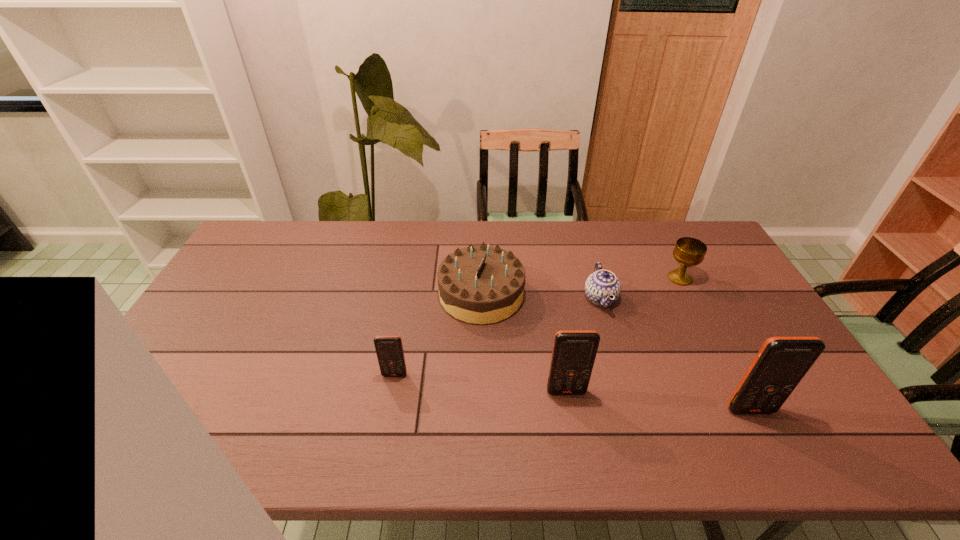
Locate an element on the screen. The height and width of the screenshot is (540, 960). the farthest cellular telephone is located at coordinates (389, 349).

Locate an element on the screen. This screenshot has width=960, height=540. the leftmost object is located at coordinates (389, 349).

Where is `the third object from left to right`? The width and height of the screenshot is (960, 540). the third object from left to right is located at coordinates (574, 351).

Find the location of a particular element. The image size is (960, 540). the second shortest cellular telephone is located at coordinates (574, 351).

In order to click on the rightmost cellular telephone in this screenshot , I will do 781,363.

This screenshot has height=540, width=960. Identify the location of the nearest object. (781, 363).

The height and width of the screenshot is (540, 960). Find the location of `chalice`. chalice is located at coordinates (688, 251).

Image resolution: width=960 pixels, height=540 pixels. Find the location of `the fifth object from right to left`. the fifth object from right to left is located at coordinates (482, 284).

The width and height of the screenshot is (960, 540). What are the coordinates of `chinaware` in the screenshot? It's located at (602, 284).

You are a GUI agent. You are given a task and a screenshot of the screen. Output one action in this format:
    pyautogui.click(x=<x>, y=<y>)
    Task: Click on the shortest object
    
    Given the screenshot: What is the action you would take?
    pyautogui.click(x=602, y=284)